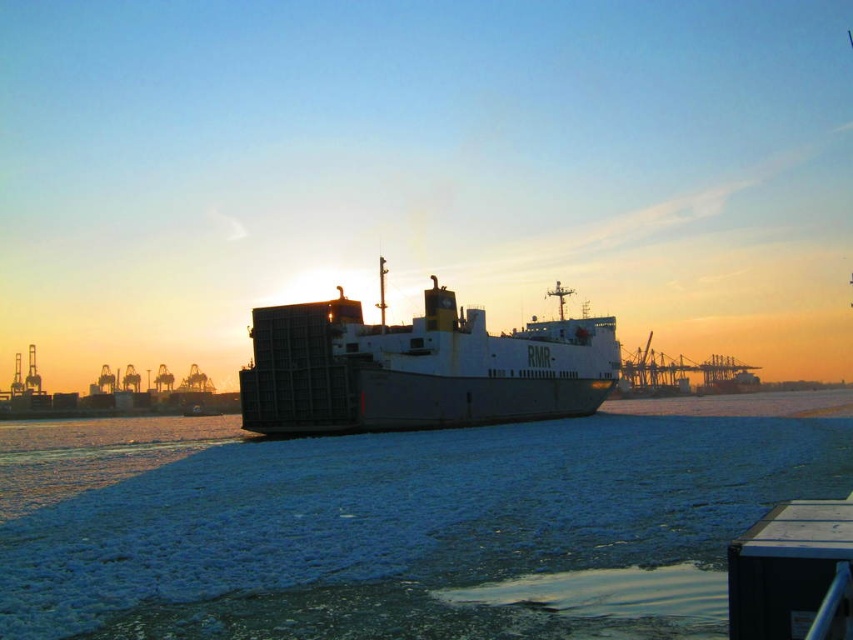
Does blue frosted water at center have a greater width compared to metallic gray ship at center?

Indeed, blue frosted water at center has a greater width compared to metallic gray ship at center.

Does point (512, 477) lie in front of point (384, 400)?

That is True.

The height and width of the screenshot is (640, 853). I want to click on blue frosted water at center, so pos(402,524).